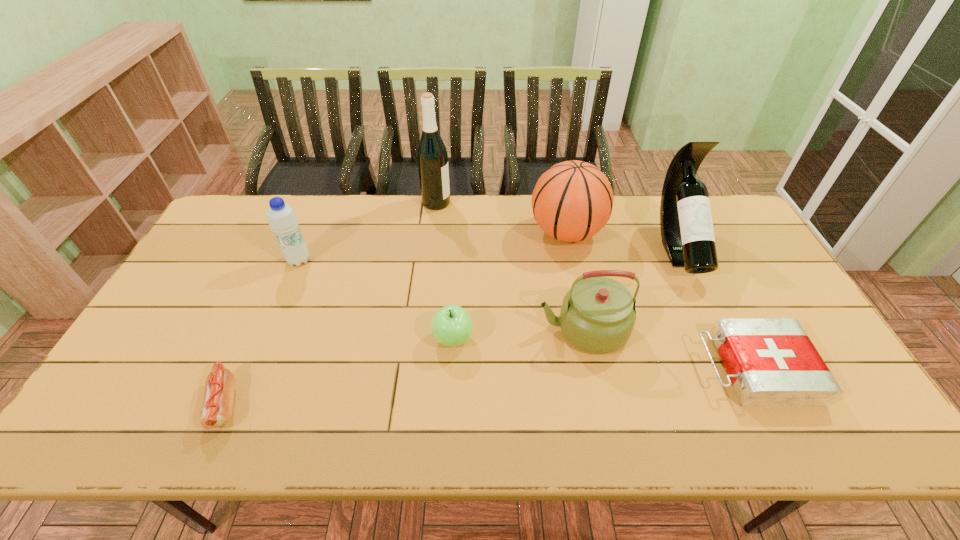
Find the location of a particular element. This screenshot has height=540, width=960. free space between the water bottle and the sausage is located at coordinates (262, 332).

This screenshot has width=960, height=540. What are the coordinates of `free space between the left wine bottle and the sixth tallest object` in the screenshot? It's located at (444, 271).

Locate which object is the closest to the water bottle. Please provide its 2D coordinates. Your answer should be formatted as a tuple, i.e. [(x, y)], where the tuple contains the x and y coordinates of a point satisfying the conditions above.

[(216, 410)]

Where is `the fifth closest object to the kettle`? the fifth closest object to the kettle is located at coordinates (432, 157).

The height and width of the screenshot is (540, 960). In order to click on vacant region that satisfies the following two spatial constraints: 1. on the stand of the right wine bottle; 2. at the spout of the kettle in this screenshot , I will do `click(715, 329)`.

This screenshot has width=960, height=540. Identify the location of vacant space that satisfies the following two spatial constraints: 1. on the label of the third shortest object; 2. on the right side of the farther wine bottle. (420, 339).

Image resolution: width=960 pixels, height=540 pixels. I want to click on blank area in the image that satisfies the following two spatial constraints: 1. on the back side of the apple; 2. on the label of the taller wine bottle, so click(460, 202).

Where is `free space that satisfies the following two spatial constraints: 1. on the label of the apple; 2. on the left side of the tallest object`? free space that satisfies the following two spatial constraints: 1. on the label of the apple; 2. on the left side of the tallest object is located at coordinates (420, 339).

At what (x,y) coordinates should I click in order to perform the action: click on free region that satisfies the following two spatial constraints: 1. on the label of the left wine bottle; 2. on the back side of the basketball. Please return your answer as a coordinate pair (x, y). Looking at the image, I should click on pyautogui.click(x=433, y=233).

Where is `vacant region that satisfies the following two spatial constraints: 1. on the stand of the seventh shortest object; 2. at the spout of the kettle`? vacant region that satisfies the following two spatial constraints: 1. on the stand of the seventh shortest object; 2. at the spout of the kettle is located at coordinates (715, 329).